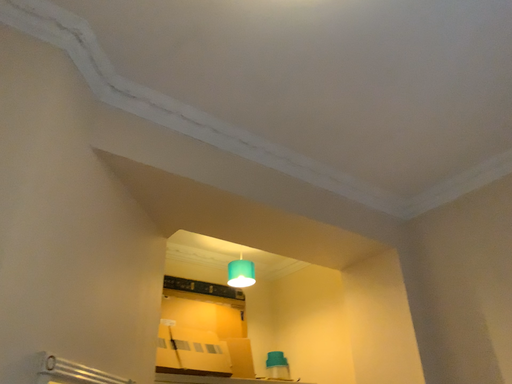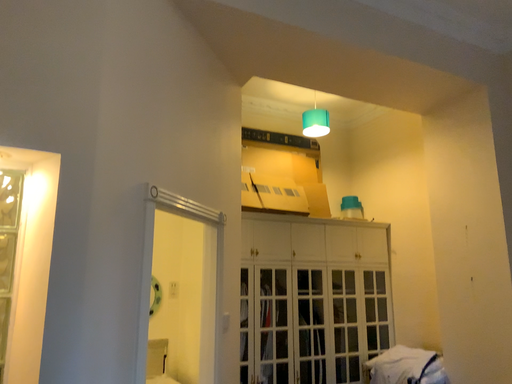
Question: How did the camera likely rotate when shooting the video?

Choices:
 (A) rotated downward
 (B) rotated upward

Answer: (A)